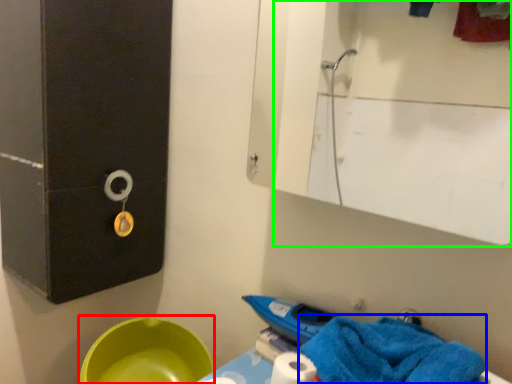
Question: Which object is the farthest from basin (highlighted by a red box)? Choose among these: bath towel (highlighted by a blue box) or mirror (highlighted by a green box).

Choices:
 (A) bath towel
 (B) mirror

Answer: (B)